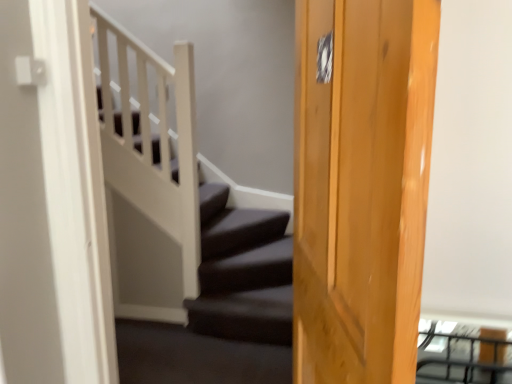
This screenshot has height=384, width=512. I want to click on light brown wooden door at center, so click(361, 187).

The image size is (512, 384). Describe the element at coordinates (361, 187) in the screenshot. I see `light brown wooden door at center` at that location.

Find the location of a particular element. Image resolution: width=512 pixels, height=384 pixels. light brown wooden door at center is located at coordinates (361, 187).